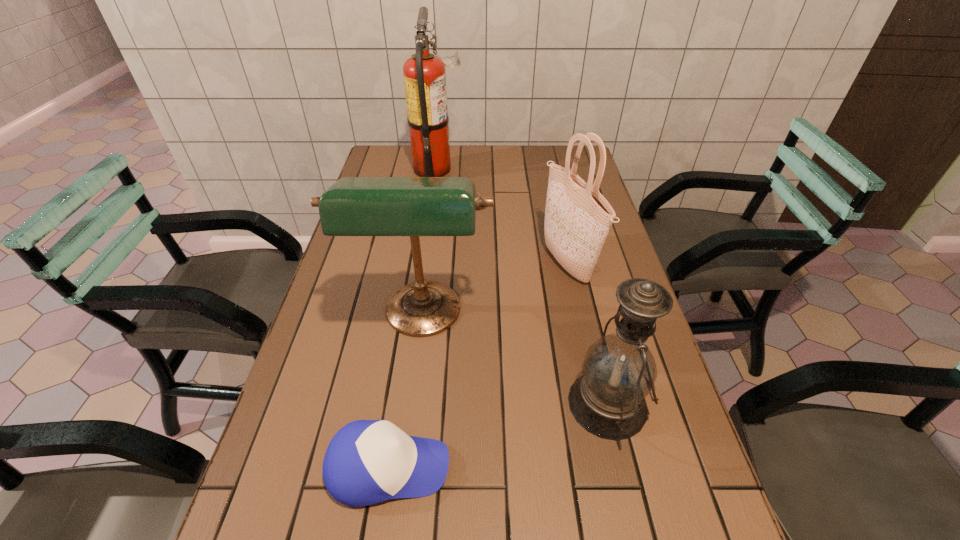
Where is `free region at the right edge of the desktop`? Image resolution: width=960 pixels, height=540 pixels. free region at the right edge of the desktop is located at coordinates (608, 244).

Where is `free space at the far left corner`? The image size is (960, 540). free space at the far left corner is located at coordinates (393, 176).

Locate an element on the screen. The image size is (960, 540). vacant area that lies between the shopping bag and the table lamp is located at coordinates tap(494, 291).

Identify the location of vacant region between the table lamp and the farthest object. Image resolution: width=960 pixels, height=540 pixels. (430, 244).

At what (x,y) coordinates should I click in order to perform the action: click on free area in between the fire extinguisher and the oil lamp. Please return your answer as a coordinate pair (x, y). Looking at the image, I should click on (522, 287).

Identify which object is located as the fourth nearest to the shortest object. Please provide its 2D coordinates. Your answer should be formatted as a tuple, i.e. [(x, y)], where the tuple contains the x and y coordinates of a point satisfying the conditions above.

[(424, 74)]

Identify which object is the fourth closest to the table lamp. Please provide its 2D coordinates. Your answer should be formatted as a tuple, i.e. [(x, y)], where the tuple contains the x and y coordinates of a point satisfying the conditions above.

[(424, 74)]

I want to click on free region that satisfies the following two spatial constraints: 1. above the green lampshade of the table lamp; 2. on the front-facing side of the shortest object, so click(x=403, y=468).

Identify the location of free space that satisfies the following two spatial constraints: 1. from the nozzle of the farthest object; 2. on the left side of the oil lamp. (406, 404).

You are a GUI agent. You are given a task and a screenshot of the screen. Output one action in this format:
    pyautogui.click(x=<x>, y=<y>)
    Task: Click on the free space that satisfies the following two spatial constraints: 1. from the nozzle of the oil lamp; 2. on the right side of the fire extinguisher
    
    Given the screenshot: What is the action you would take?
    pyautogui.click(x=406, y=404)